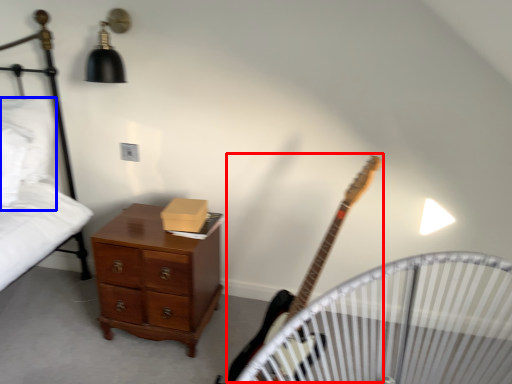
Question: Among these objects, which one is nearest to the camera, guitar (highlighted by a red box) or pillow (highlighted by a blue box)?

Choices:
 (A) guitar
 (B) pillow

Answer: (A)